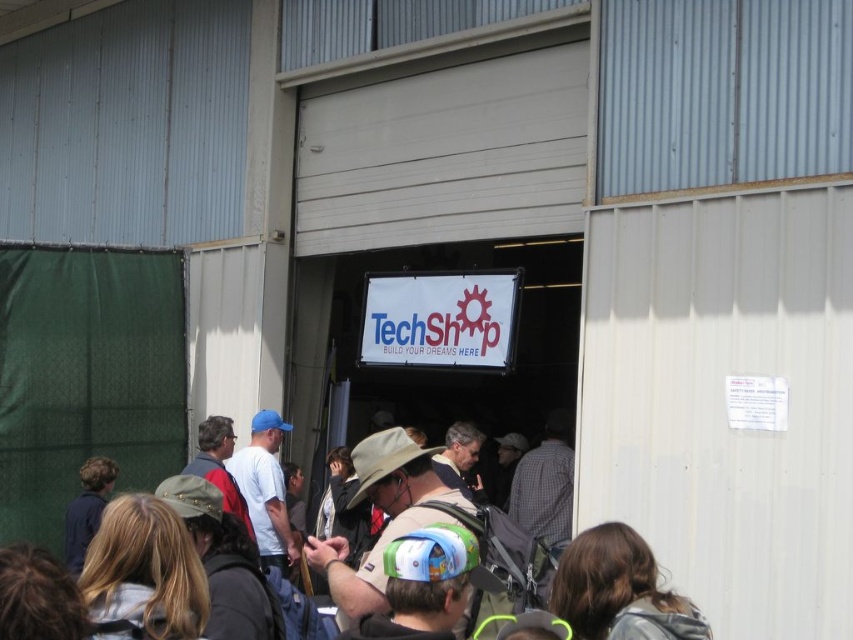
You are organizing an outdoor event at TechShop and need to place a new banner between the brown fabric backpack at center and the white fabric sign at center. Which object should the banner be placed closer to if it needs to be larger than both?

The banner should be placed closer to the white fabric sign at center because the brown fabric backpack at center is smaller than the white fabric sign at center, so the larger sign can accommodate a bigger banner nearby.

You are a photographer standing at the entrance of TechShop. You want to take a photo of the crowd while ensuring both the brown fabric backpack at center and the white fabric sign at center are clearly visible. Which object should you focus on to ensure both are in frame?

The brown fabric backpack at center is positioned under the white fabric sign at center. To ensure both are in frame, focus on the white fabric sign at center first, as it is above the backpack, allowing the backpack to naturally fall into the lower part of the frame.